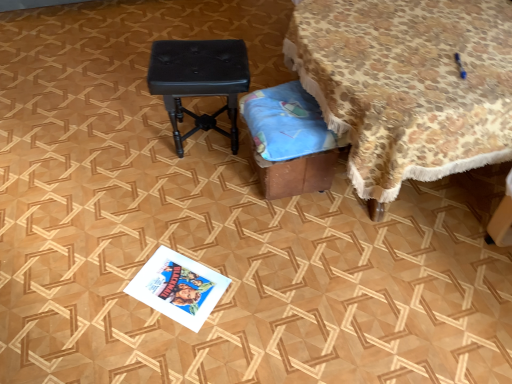
This screenshot has width=512, height=384. In order to click on free space between black leather stool at center and white glossy magazine at lower center in this screenshot , I will do `click(194, 211)`.